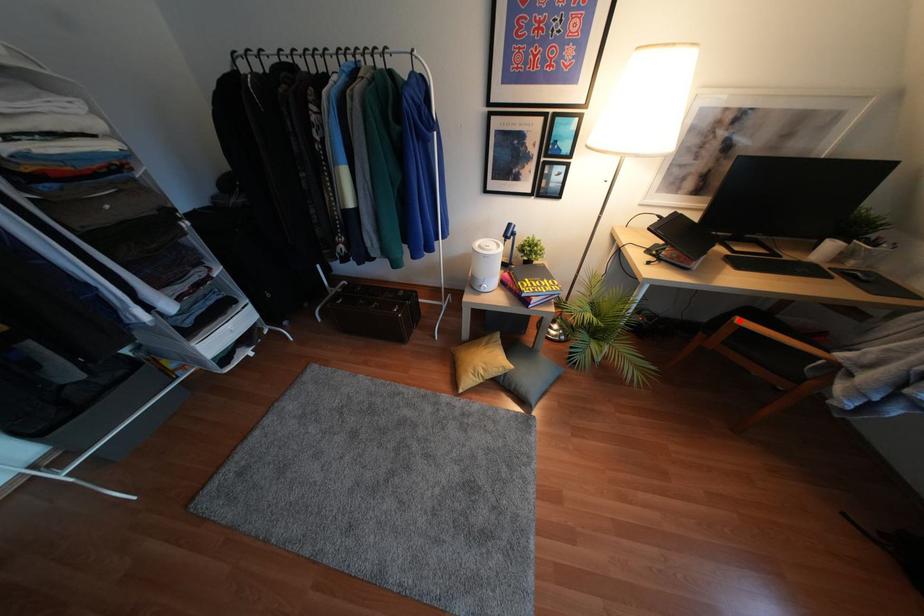
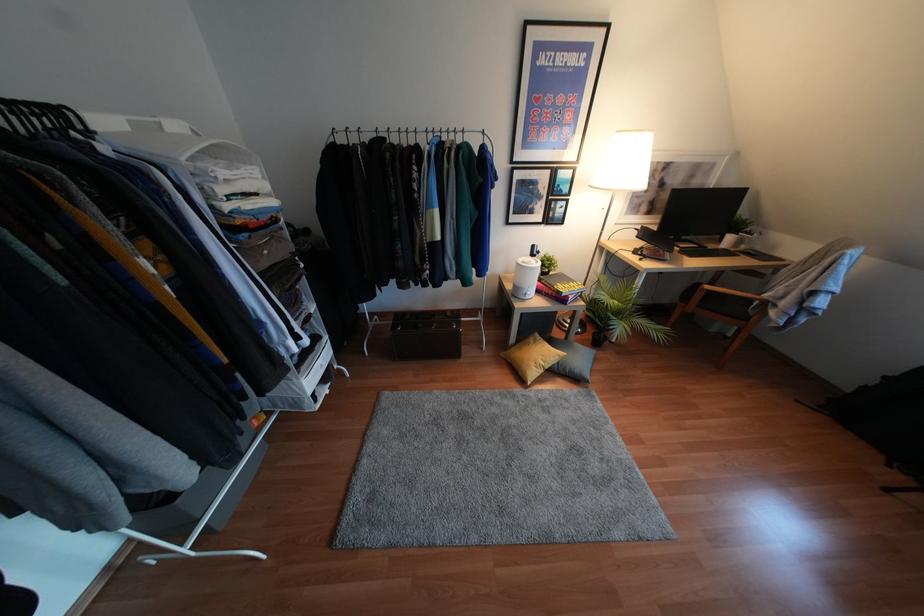
In the second image, find the point that corresponds to the highlighted location in the first image.

(707, 286)